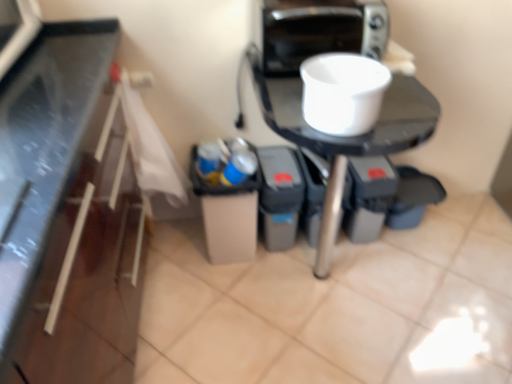
This screenshot has height=384, width=512. I want to click on blank area to the left of white glossy table at center, so click(199, 302).